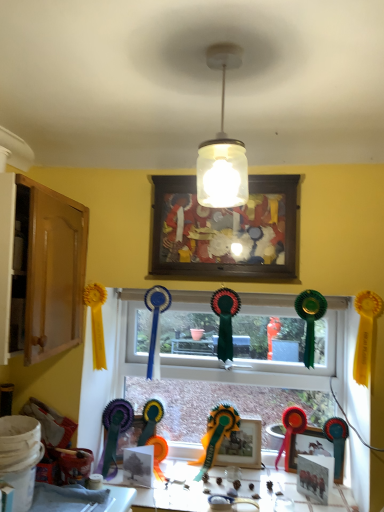
Question: Which direction should I rotate to look at matte white picture frame at lower center, which appears as the 2th picture frame when viewed from the front, — up or down?

Choices:
 (A) down
 (B) up

Answer: (A)

Question: From the image's perspective, is white glossy table at lower center on translucent glass jar at center?

Choices:
 (A) no
 (B) yes

Answer: (A)

Question: Does white glossy table at lower center have a lesser height compared to translucent glass jar at center?

Choices:
 (A) no
 (B) yes

Answer: (B)

Question: Does white glossy table at lower center have a smaller size compared to translucent glass jar at center?

Choices:
 (A) no
 (B) yes

Answer: (A)

Question: Does white glossy table at lower center come in front of translucent glass jar at center?

Choices:
 (A) no
 (B) yes

Answer: (A)

Question: Considering the relative sizes of white glossy table at lower center and translucent glass jar at center in the image provided, is white glossy table at lower center taller than translucent glass jar at center?

Choices:
 (A) no
 (B) yes

Answer: (A)

Question: From a real-world perspective, is white glossy table at lower center physically below translucent glass jar at center?

Choices:
 (A) yes
 (B) no

Answer: (A)

Question: Is white glossy table at lower center far from matte white picture frame at lower center, the fourth picture frame in the top-to-bottom sequence?

Choices:
 (A) yes
 (B) no

Answer: (B)

Question: From the image's perspective, is white glossy table at lower center beneath matte white picture frame at lower center, which appears as the 2th picture frame when viewed from the front?

Choices:
 (A) yes
 (B) no

Answer: (A)

Question: Is matte white picture frame at lower center, marked as the first picture frame in a bottom-to-top arrangement, at the back of white glossy table at lower center?

Choices:
 (A) yes
 (B) no

Answer: (B)

Question: From a real-world perspective, is white glossy table at lower center over matte white picture frame at lower center, which is the third picture frame from back to front?

Choices:
 (A) no
 (B) yes

Answer: (A)

Question: Is white glossy table at lower center positioned in front of matte white picture frame at lower center, marked as the first picture frame in a bottom-to-top arrangement?

Choices:
 (A) no
 (B) yes

Answer: (B)

Question: Is white glossy table at lower center positioned behind matte white picture frame at lower center, which is the third picture frame from back to front?

Choices:
 (A) no
 (B) yes

Answer: (A)

Question: Would you say wooden photo frame at center, arranged as the second picture frame when viewed from the top, contains matte plastic picture frame at lower right, which is the 3th picture frame in front-to-back order?

Choices:
 (A) yes
 (B) no

Answer: (B)